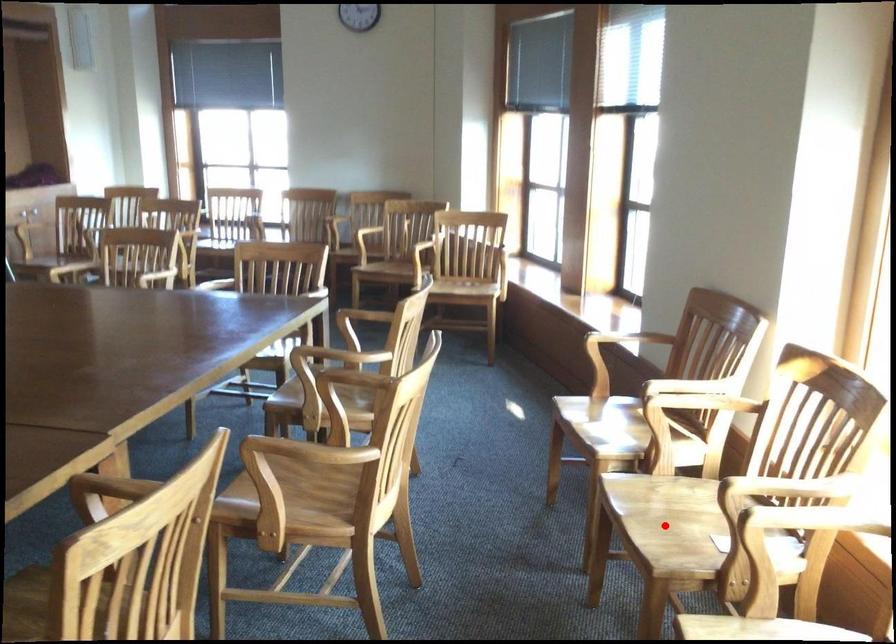
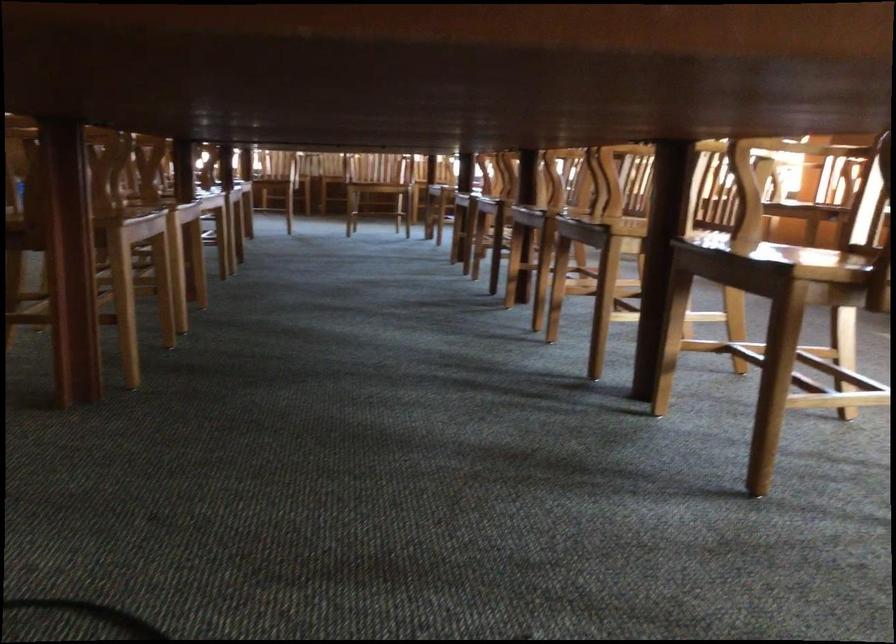
Question: I am providing you with two images of the same scene from different viewpoints. A red point is marked on the first image. At the location where the point appears in image 1, is it still visible in image 2?

Choices:
 (A) Yes
 (B) No

Answer: (B)